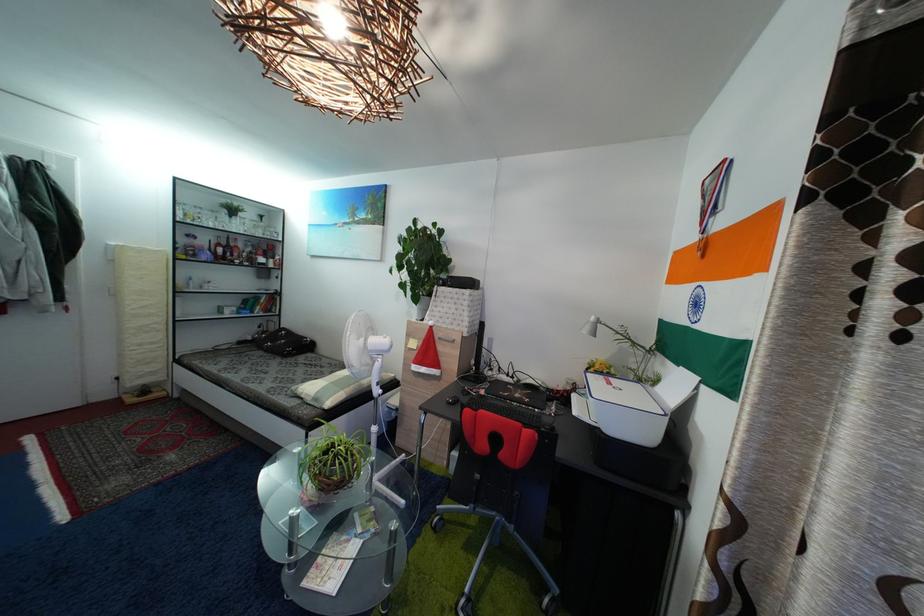
Where is `white printer lid`? Image resolution: width=924 pixels, height=616 pixels. white printer lid is located at coordinates (621, 392).